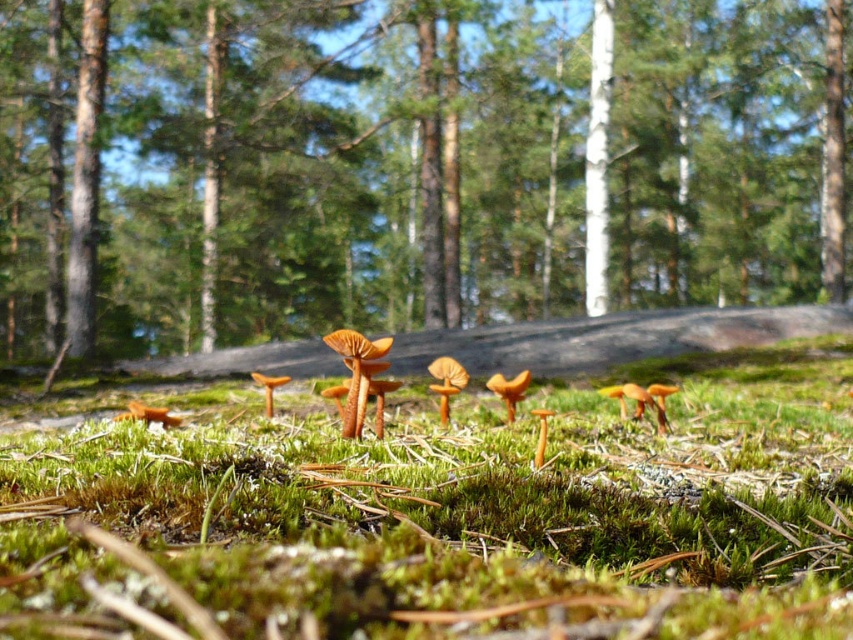
You are standing in the forest and want to take a photo of the brown wood tree at center. If your camera can focus on objects up to 10 meters away, will it be able to capture the tree clearly?

The brown wood tree at center is 10.85 meters away from the camera, which exceeds the camera focus range of 10 meters. Therefore, the camera cannot capture the tree clearly.

You are standing in the forest and want to take a photo of the brown wood tree at center and the green mossy ground at center. Which object should be in the foreground of your photo to ensure both are visible?

The brown wood tree at center should be in the foreground because the green mossy ground at center is behind it, allowing both to be visible in the photo.